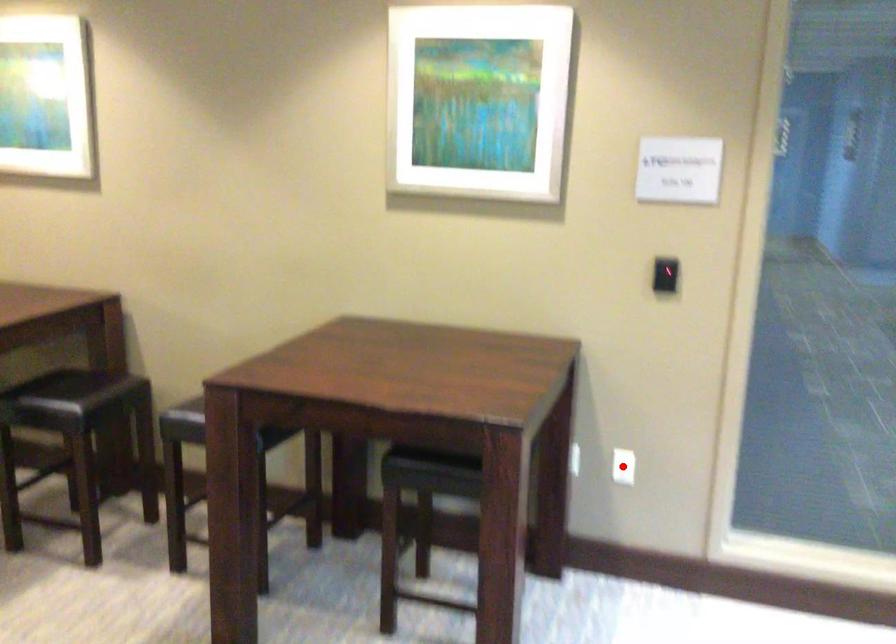
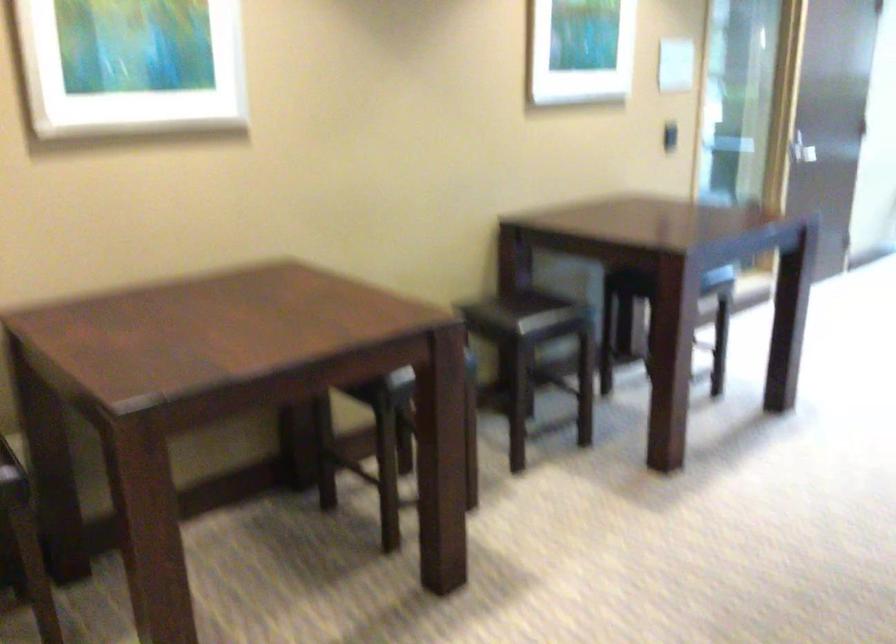
Question: I am providing you with two images of the same scene from different viewpoints. A red point is marked on the first image. Can you still see the location of the red point in image 2?

Choices:
 (A) Yes
 (B) No

Answer: (B)